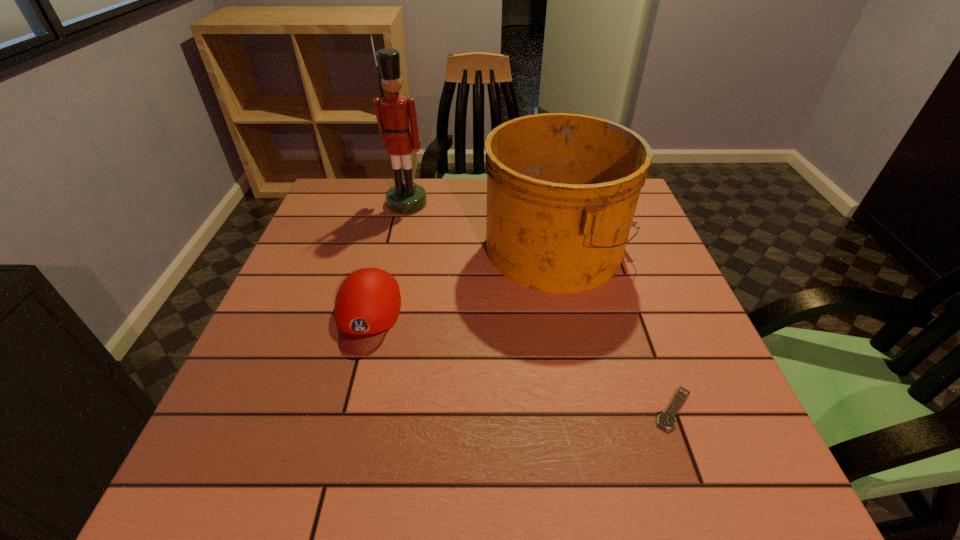
The width and height of the screenshot is (960, 540). I want to click on unoccupied area between the bucket and the nutcracker, so click(x=482, y=225).

Find the location of a particular element. vacant area between the tallest object and the bucket is located at coordinates (482, 225).

You are a GUI agent. You are given a task and a screenshot of the screen. Output one action in this format:
    pyautogui.click(x=<x>, y=<y>)
    Task: Click on the empty location between the second tallest object and the tallest object
    The image size is (960, 540).
    Given the screenshot: What is the action you would take?
    pyautogui.click(x=482, y=225)

This screenshot has width=960, height=540. In order to click on empty space that is in between the baseball cap and the nutcracker in this screenshot , I will do `click(387, 260)`.

Identify the location of empty space between the third tallest object and the shortest object. (520, 363).

This screenshot has height=540, width=960. I want to click on free space between the second shortest object and the nutcracker, so click(387, 260).

The image size is (960, 540). In order to click on vacant area that lies between the shortest object and the bucket in this screenshot , I will do (x=615, y=328).

What are the coordinates of `free spot between the nutcracker and the shortest object` in the screenshot? It's located at (540, 306).

Select which object is the second closest to the tallest object. Please provide its 2D coordinates. Your answer should be formatted as a tuple, i.e. [(x, y)], where the tuple contains the x and y coordinates of a point satisfying the conditions above.

[(368, 302)]

Locate an element on the screen. This screenshot has width=960, height=540. object that stands as the third closest to the bucket is located at coordinates (667, 420).